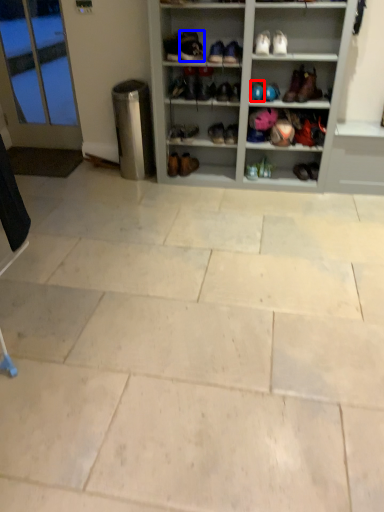
Question: Among these objects, which one is nearest to the camera, footwear (highlighted by a red box) or shoe (highlighted by a blue box)?

Choices:
 (A) footwear
 (B) shoe

Answer: (B)